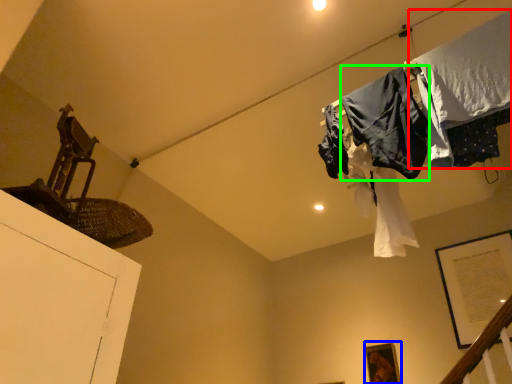
Question: Which is nearer to the clothing (highlighted by a red box)? picture frame (highlighted by a blue box) or clothing (highlighted by a green box).

Choices:
 (A) picture frame
 (B) clothing

Answer: (B)